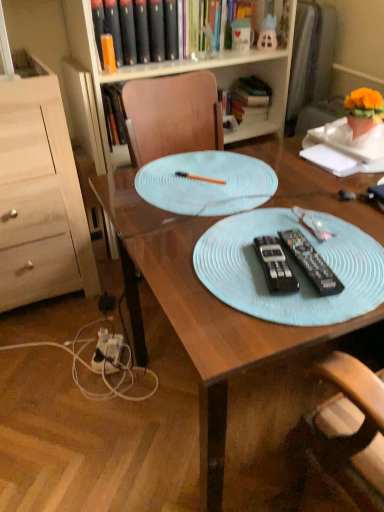
Where is `free area behind black plastic remote control at center, which appears as the 1th remote control when viewed from the left`? This screenshot has height=512, width=384. free area behind black plastic remote control at center, which appears as the 1th remote control when viewed from the left is located at coordinates (258, 220).